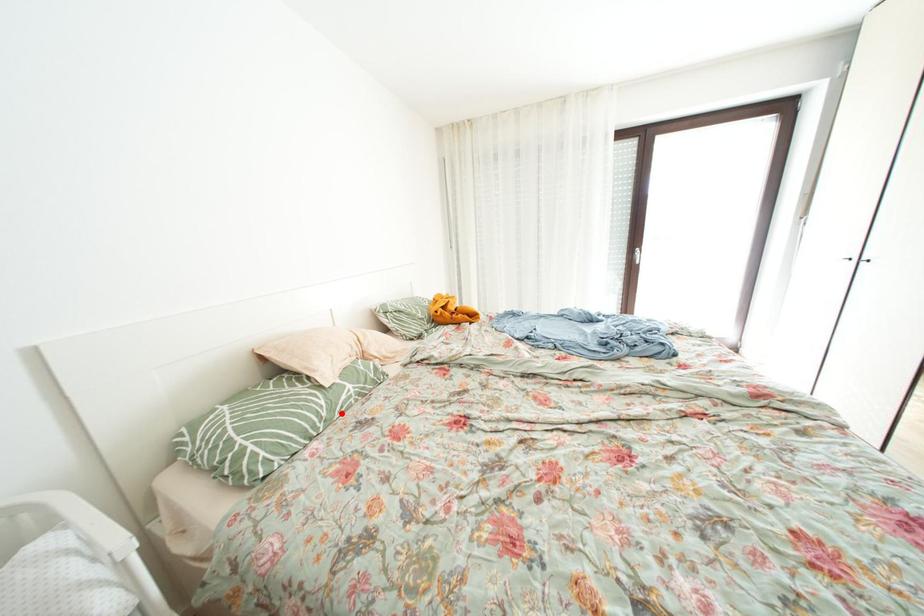
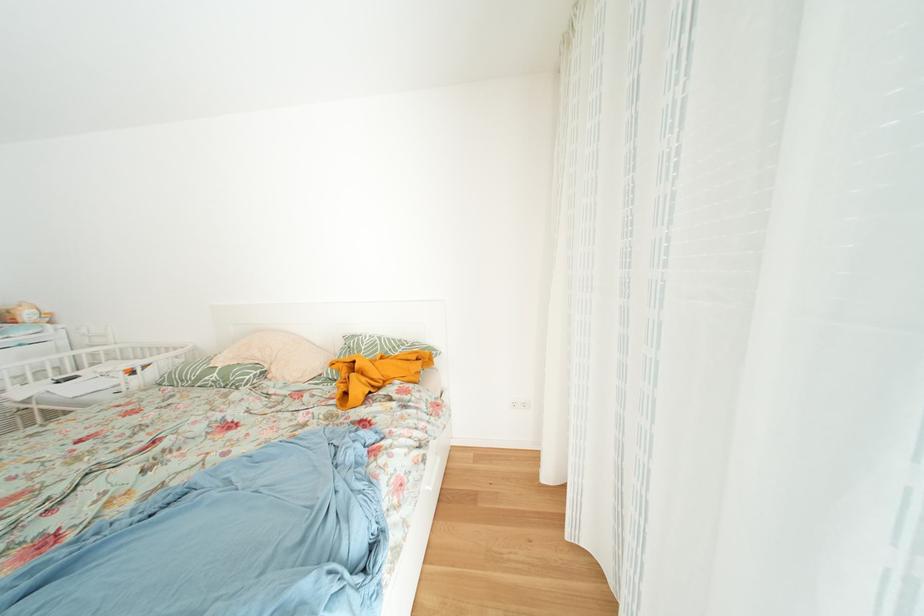
Locate, in the second image, the point that corresponds to the highlighted location in the first image.

(208, 384)